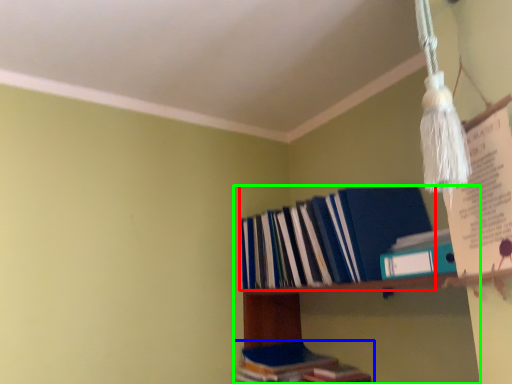
Question: Which is farther away from book (highlighted by a red box)? book (highlighted by a blue box) or shelf (highlighted by a green box)?

Choices:
 (A) book
 (B) shelf

Answer: (A)